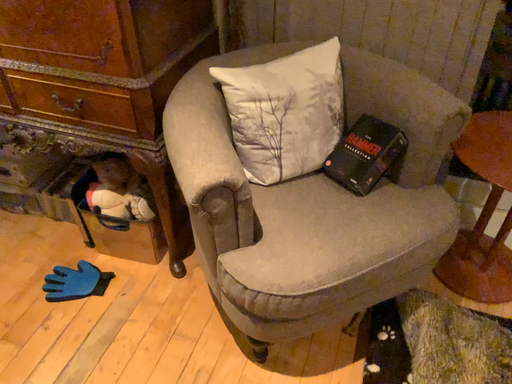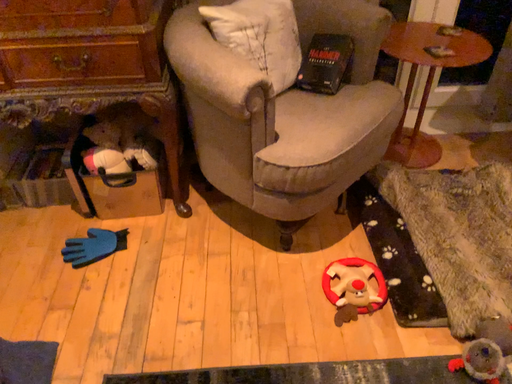
Question: Which way did the camera rotate in the video?

Choices:
 (A) rotated left
 (B) rotated right

Answer: (B)